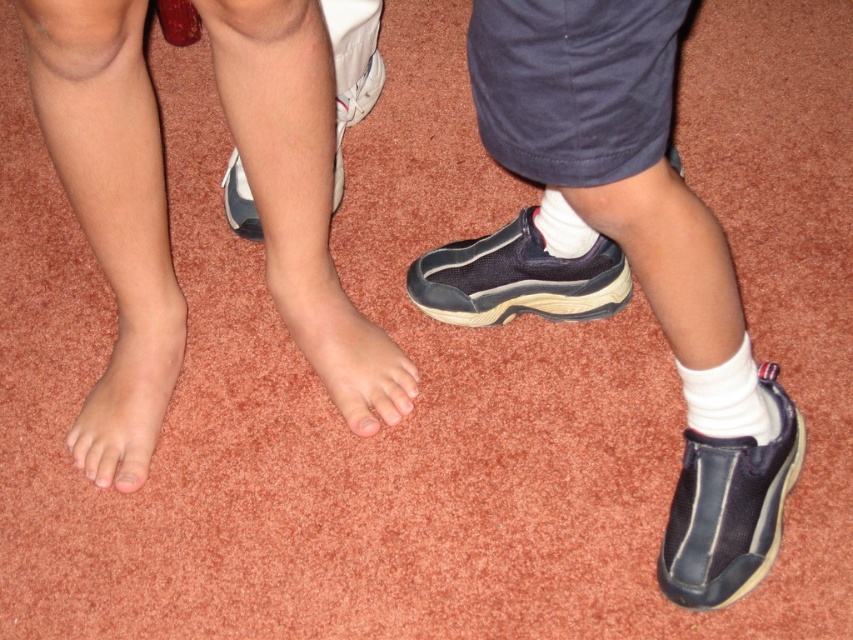
Which of these two, navy blue fabric shoe at lower right or pink matte toe at center, stands taller?

navy blue fabric shoe at lower right

Can you confirm if navy blue fabric shoe at lower right is positioned below pink matte toe at center?

Yes.

Find the location of a particular element. navy blue fabric shoe at lower right is located at coordinates tap(729, 508).

Is point (646, 86) positioned behind point (93, 404)?

That is False.

Does matte blue shoe at right have a greater height compared to pale skin foot at lower left?

Answer: Correct, matte blue shoe at right is much taller as pale skin foot at lower left.

Which is behind, point (682, 538) or point (79, 417)?

The point (79, 417) is more distant.

Image resolution: width=853 pixels, height=640 pixels. I want to click on matte blue shoe at right, so click(x=585, y=177).

Does white soft sock at lower right have a smaller size compared to white leather shoe at center?

Indeed, white soft sock at lower right has a smaller size compared to white leather shoe at center.

Between white soft sock at lower right and white leather shoe at center, which one has more height?

With more height is white leather shoe at center.

Between point (741, 424) and point (335, 128), which one is positioned behind?

Point (335, 128)

You are a GUI agent. You are given a task and a screenshot of the screen. Output one action in this format:
    pyautogui.click(x=<x>, y=<y>)
    Task: Click on the white soft sock at lower right
    The width and height of the screenshot is (853, 640).
    Given the screenshot: What is the action you would take?
    pyautogui.click(x=730, y=400)